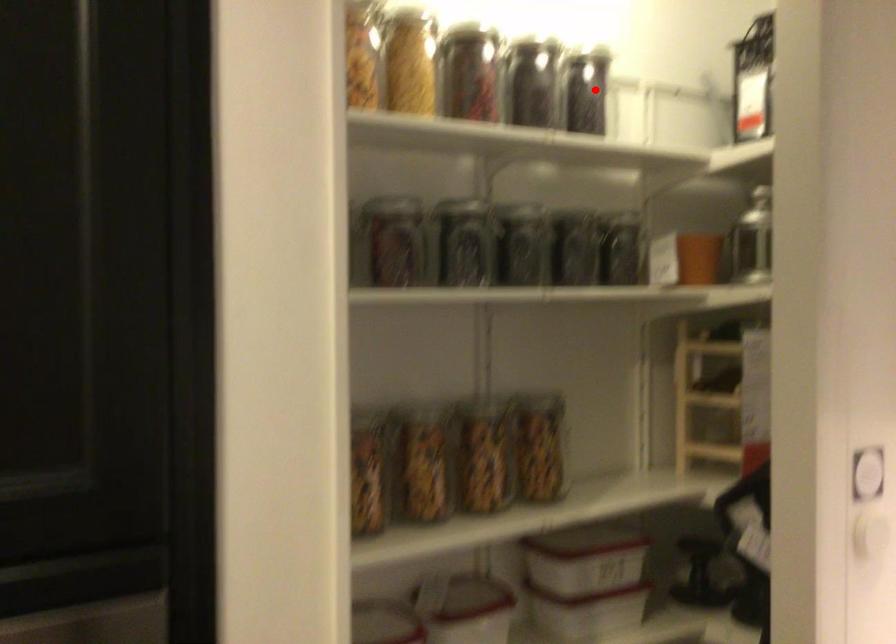
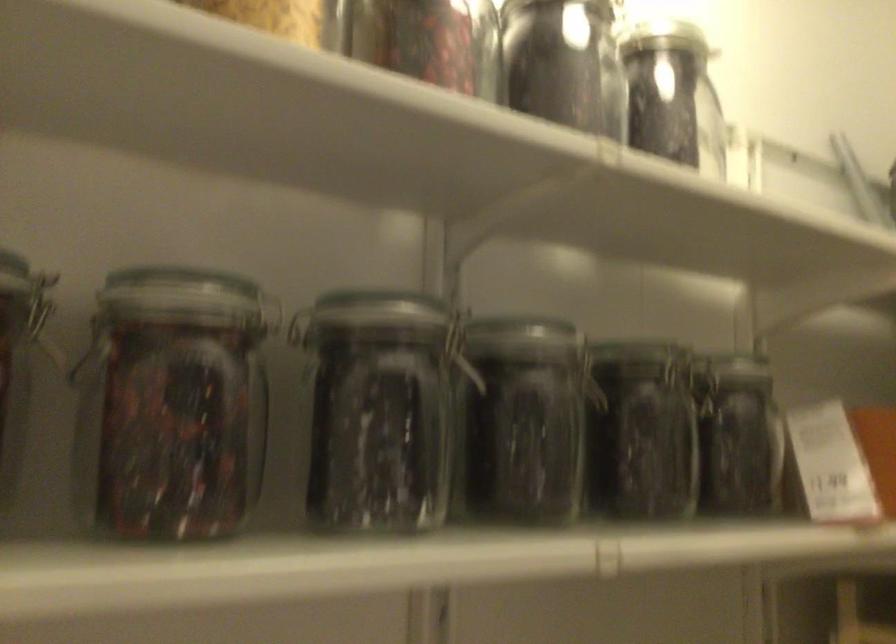
Question: A red point is marked in image1. In image2, is the corresponding 3D point closer to the camera or farther? Reply with the corresponding letter.

Choices:
 (A) The corresponding 3D point is closer.
 (B) The corresponding 3D point is farther.

Answer: (A)